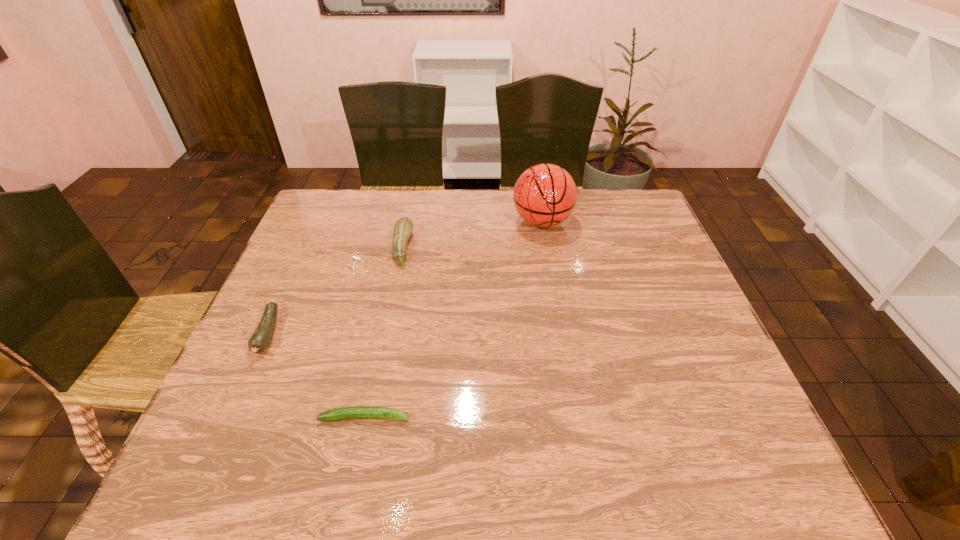
Identify the location of vacant region at the near right corner of the desktop. This screenshot has height=540, width=960. (712, 466).

The width and height of the screenshot is (960, 540). What are the coordinates of `vacant space that is in between the tallest zucchini and the basketball` in the screenshot? It's located at (472, 234).

This screenshot has height=540, width=960. What are the coordinates of `vacant point located between the tallest zucchini and the second nearest object` in the screenshot? It's located at (336, 291).

This screenshot has height=540, width=960. I want to click on vacant space in between the nearest object and the third farthest object, so click(317, 375).

Find the location of a particular element. vacant area that lies between the basketball and the nearest zucchini is located at coordinates (453, 319).

The image size is (960, 540). Identify the location of vacant area that lies between the farthest zucchini and the rightmost object. [472, 234].

The height and width of the screenshot is (540, 960). Identify the location of free point between the basketball and the farthest zucchini. (472, 234).

This screenshot has width=960, height=540. I want to click on empty space that is in between the rightmost object and the third shortest object, so click(472, 234).

Locate an element on the screen. This screenshot has height=540, width=960. empty space that is in between the tallest zucchini and the basketball is located at coordinates (472, 234).

Where is `vacant region between the shortest zucchini and the tallest zucchini`? vacant region between the shortest zucchini and the tallest zucchini is located at coordinates (384, 332).